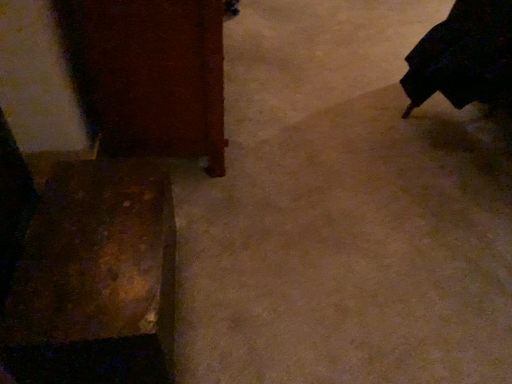
Question: Should I look upward or downward to see wooden cabinet at left, arranged as the 2th furniture when ordered from the bottom?

Choices:
 (A) down
 (B) up

Answer: (B)

Question: Is wooden cabinet at left, which is the first furniture from top to bottom, to the left of rusty metal box at lower left, the 2th furniture from the top, from the viewer's perspective?

Choices:
 (A) no
 (B) yes

Answer: (A)

Question: From a real-world perspective, is wooden cabinet at left, which is the first furniture from top to bottom, physically above rusty metal box at lower left, the first furniture when ordered from bottom to top?

Choices:
 (A) yes
 (B) no

Answer: (A)

Question: From the image's perspective, is wooden cabinet at left, arranged as the 2th furniture when ordered from the bottom, under rusty metal box at lower left, the first furniture when ordered from bottom to top?

Choices:
 (A) yes
 (B) no

Answer: (B)

Question: Is wooden cabinet at left, arranged as the 2th furniture when ordered from the bottom, wider than rusty metal box at lower left, the 2th furniture from the top?

Choices:
 (A) yes
 (B) no

Answer: (A)

Question: Is the position of wooden cabinet at left, arranged as the 2th furniture when ordered from the bottom, less distant than that of rusty metal box at lower left, the 2th furniture from the top?

Choices:
 (A) yes
 (B) no

Answer: (B)

Question: Is rusty metal box at lower left, the 2th furniture from the top, a part of wooden cabinet at left, which is the first furniture from top to bottom?

Choices:
 (A) no
 (B) yes

Answer: (A)

Question: Is rusty metal box at lower left, the first furniture when ordered from bottom to top, to the right of black matte robe at right from the viewer's perspective?

Choices:
 (A) yes
 (B) no

Answer: (B)

Question: Is rusty metal box at lower left, the first furniture when ordered from bottom to top, beside black matte robe at right?

Choices:
 (A) no
 (B) yes

Answer: (A)

Question: Is black matte robe at right at the back of rusty metal box at lower left, the 2th furniture from the top?

Choices:
 (A) no
 (B) yes

Answer: (A)

Question: Does rusty metal box at lower left, the first furniture when ordered from bottom to top, have a lesser height compared to black matte robe at right?

Choices:
 (A) yes
 (B) no

Answer: (A)

Question: Does rusty metal box at lower left, the 2th furniture from the top, appear on the left side of black matte robe at right?

Choices:
 (A) yes
 (B) no

Answer: (A)

Question: Does rusty metal box at lower left, the first furniture when ordered from bottom to top, have a smaller size compared to black matte robe at right?

Choices:
 (A) yes
 (B) no

Answer: (A)

Question: From the image's perspective, would you say black matte robe at right is shown under wooden cabinet at left, which is the first furniture from top to bottom?

Choices:
 (A) no
 (B) yes

Answer: (B)